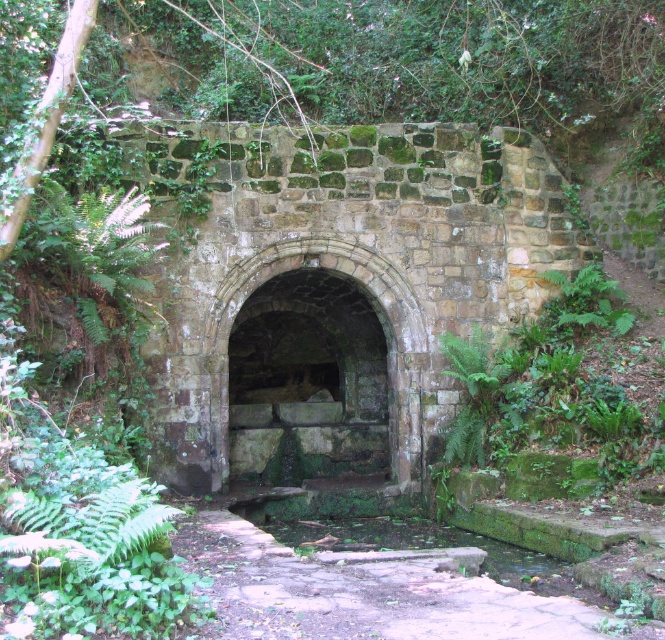
You are standing in front of the ancient stone structure in the forest. There is a point marked at coordinates (x=317, y=369). What does this point indicate?

The point at (x=317, y=369) marks the green mossy stone arch at center.

You are standing in a forest and see the green mossy stone arch at center. If you want to reach the arch, how many steps would you need to take if each of your steps is about 2.5 feet long?

The green mossy stone arch at center is 44.39 feet away. Dividing the distance by your step length of 2.5 feet gives approximately 17.75 steps. Since you can only take whole steps, you would need to take around 18 steps to reach the arch.

Consider the image. You are a hiker exploring the forest and want to pass through the green mossy stone arch at center. There is a mossy stone path at center nearby. Which direction should you walk to reach the arch from the path?

The green mossy stone arch at center is located below the mossy stone path at center, so you should walk downward from the mossy stone path at center to reach the green mossy stone arch at center.